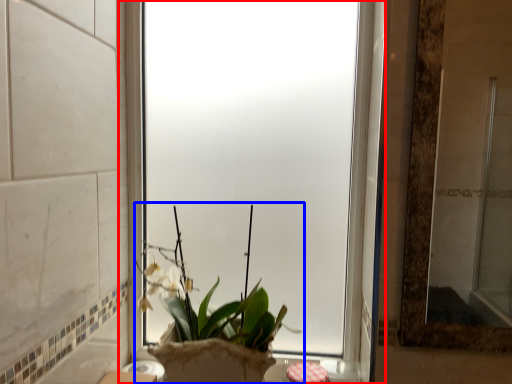
Question: Which of the following is the farthest to the observer, window (highlighted by a red box) or houseplant (highlighted by a blue box)?

Choices:
 (A) window
 (B) houseplant

Answer: (A)